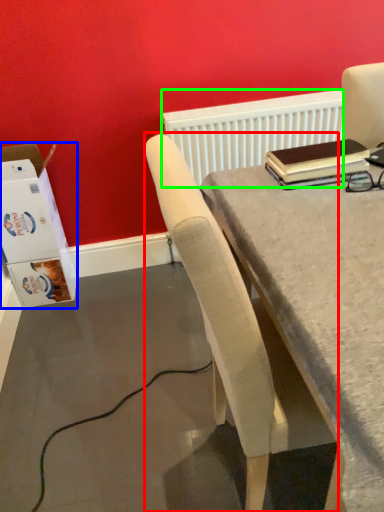
Question: Which is nearer to the chair (highlighted by a red box)? box (highlighted by a blue box) or radiator (highlighted by a green box).

Choices:
 (A) box
 (B) radiator

Answer: (B)